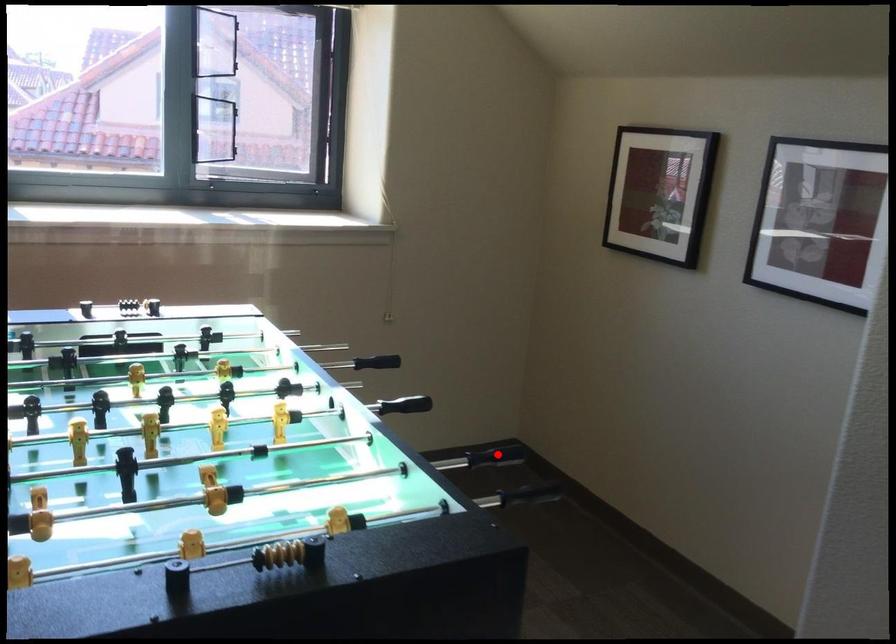
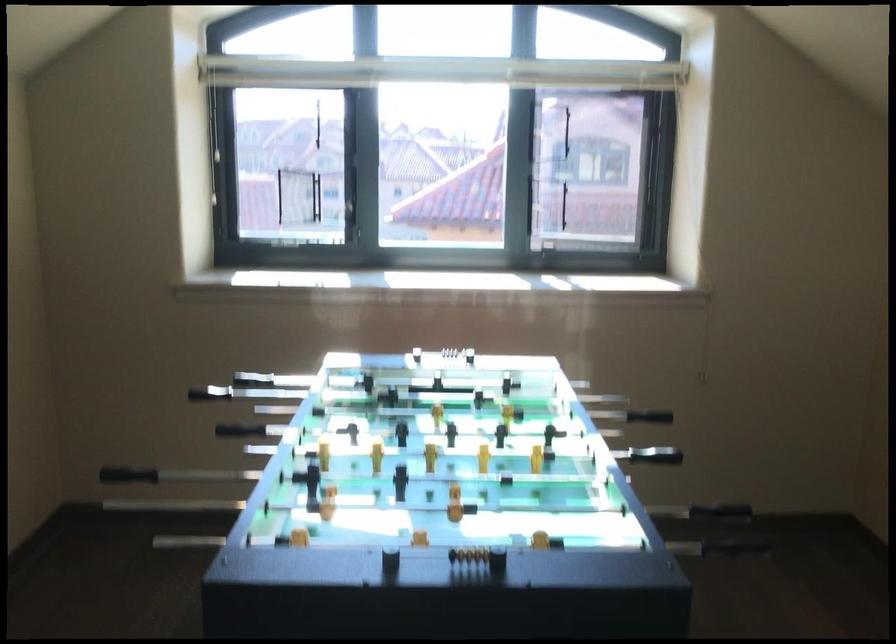
Question: I am providing you with two images of the same scene from different viewpoints. A red point is shown in image1. For the corresponding object point in image2, is it positioned nearer or farther from the camera?

Choices:
 (A) Nearer
 (B) Farther

Answer: (B)